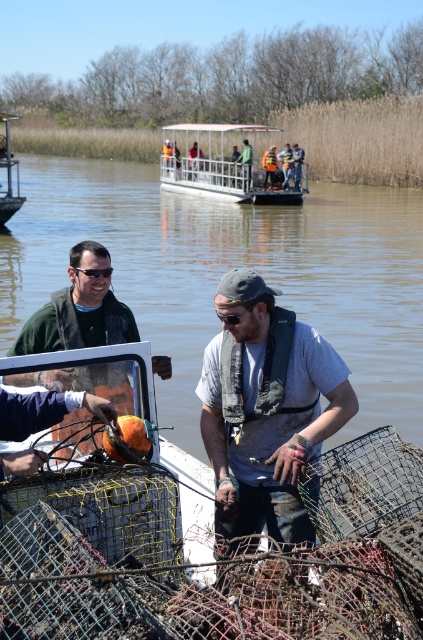
Does white plastic boat at center have a smaller size compared to green matte jacket at center?

No, white plastic boat at center is not smaller than green matte jacket at center.

Based on the photo, does white plastic boat at center have a lesser width compared to green matte jacket at center?

In fact, white plastic boat at center might be wider than green matte jacket at center.

Is point (291, 196) closer to camera compared to point (16, 458)?

That is False.

You are a GUI agent. You are given a task and a screenshot of the screen. Output one action in this format:
    pyautogui.click(x=<x>, y=<y>)
    Task: Click on the white plastic boat at center
    The width and height of the screenshot is (423, 640).
    Given the screenshot: What is the action you would take?
    pyautogui.click(x=225, y=163)

Does clear water at boat center have a greater height compared to gray fabric shirt at center?

Yes, clear water at boat center is taller than gray fabric shirt at center.

Is point (335, 440) positioned after point (216, 304)?

That is True.

Identify the location of clear water at boat center. (228, 268).

Which of these two, white plastic boat at center or orange life vest at center, stands shorter?

orange life vest at center is shorter.

Which is behind, point (159, 168) or point (263, 157)?

Point (159, 168)

Locate an element on the screen. white plastic boat at center is located at coordinates (225, 163).